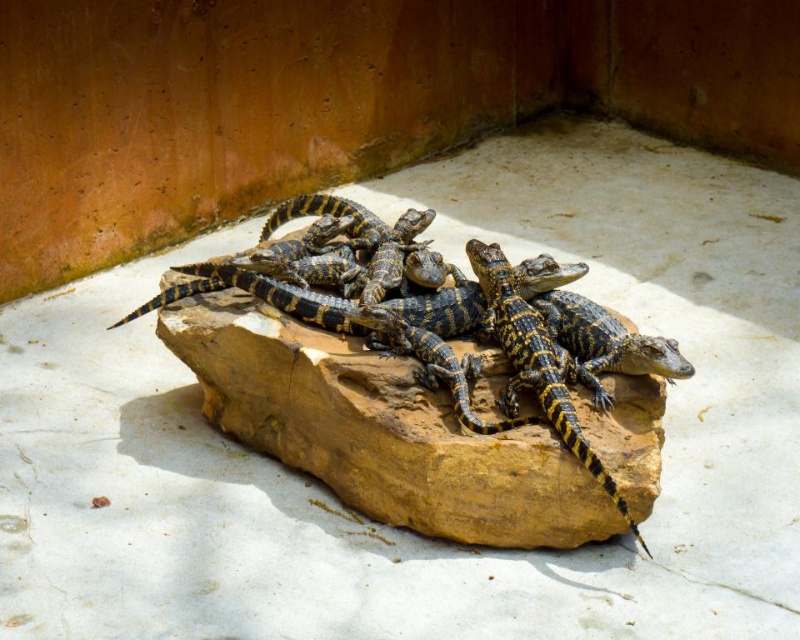
You are standing in front of a large rock with alligators resting on it. There is a point marked at coordinates (409, 417). What is located at that point?

The point at coordinates (409, 417) corresponds to the yellow and black textured crocodile at center.